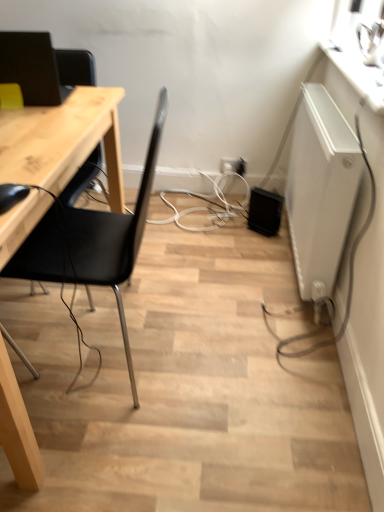
Where is `unoccupied region to the right of matte black monitor at upper left`? Image resolution: width=384 pixels, height=512 pixels. unoccupied region to the right of matte black monitor at upper left is located at coordinates (91, 100).